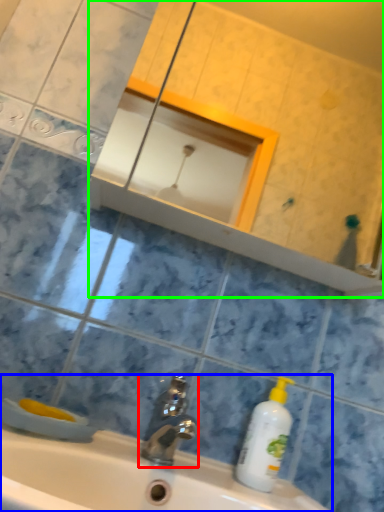
Question: Based on their relative distances, which object is farther from tap (highlighted by a red box)? Choose from sink (highlighted by a blue box) and mirror (highlighted by a green box).

Choices:
 (A) sink
 (B) mirror

Answer: (B)